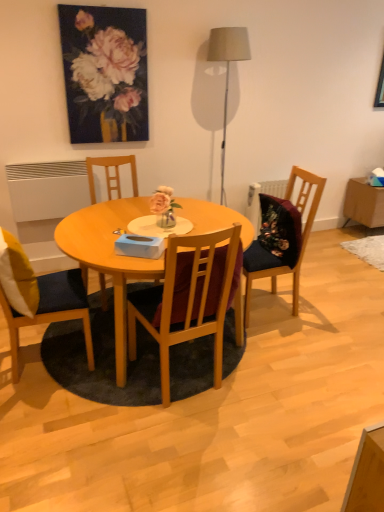
The height and width of the screenshot is (512, 384). I want to click on vacant space to the right of wooden chair at center, which appears as the third chair when viewed from the left, so coord(272,399).